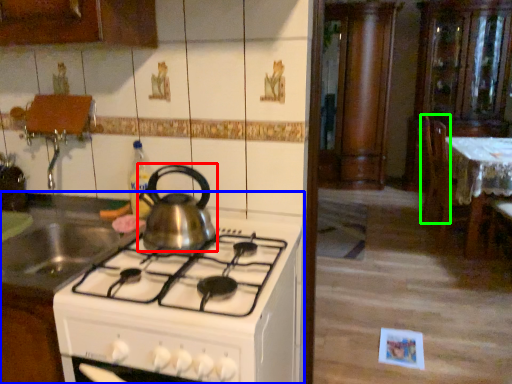
Question: Estimate the real-world distances between objects in this image. Which object is farther from kitchen appliance (highlighted by a red box), kitchen appliance (highlighted by a blue box) or chair (highlighted by a green box)?

Choices:
 (A) kitchen appliance
 (B) chair

Answer: (B)